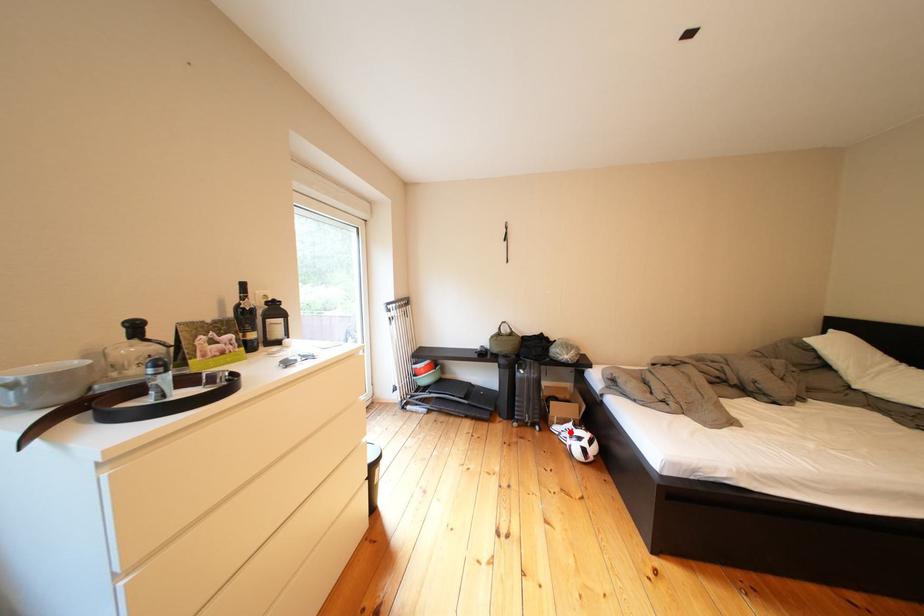
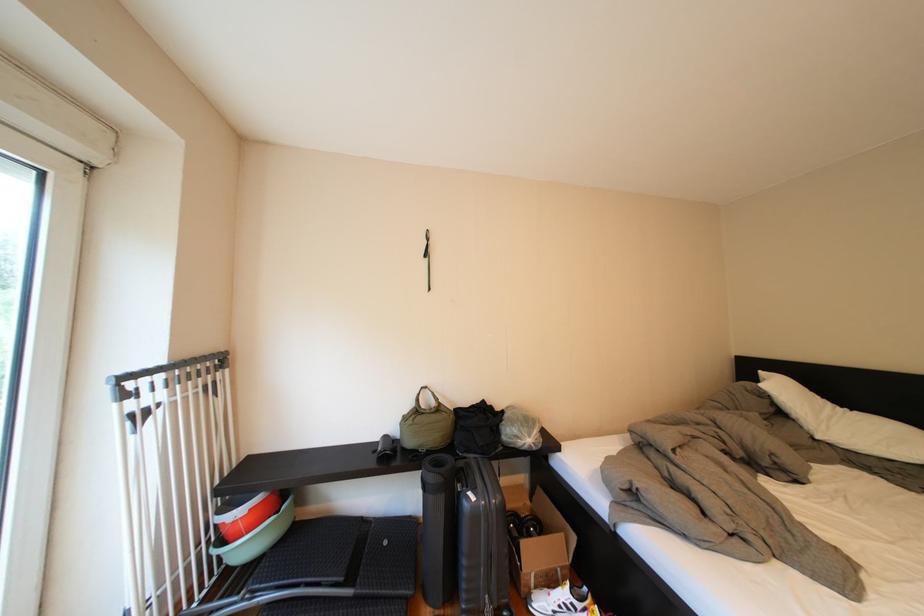
Question: I am providing you with two images of the same scene from different viewpoints. Given a red point in image1, look at the same physical point in image2. Is it:

Choices:
 (A) Closer to the viewpoint
 (B) Farther from the viewpoint

Answer: (A)